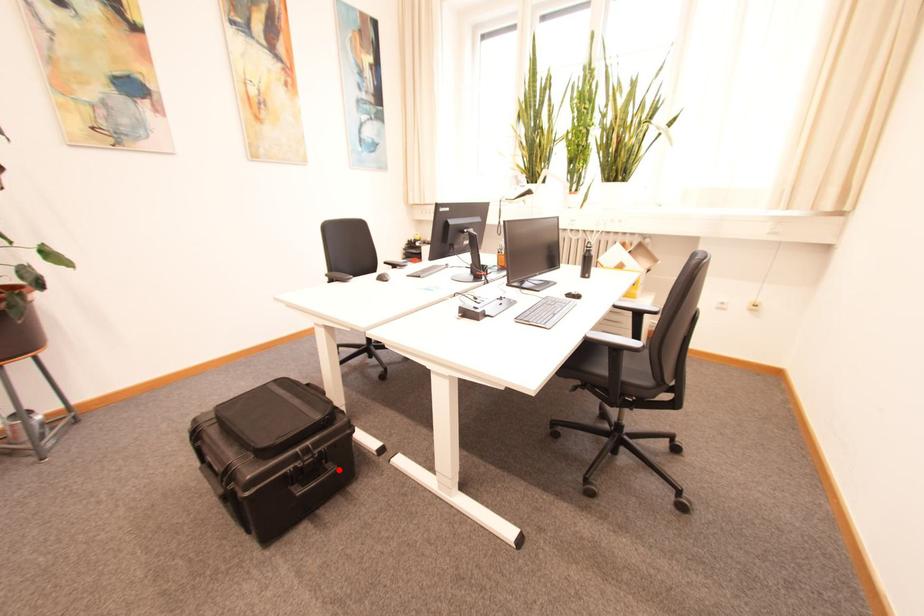
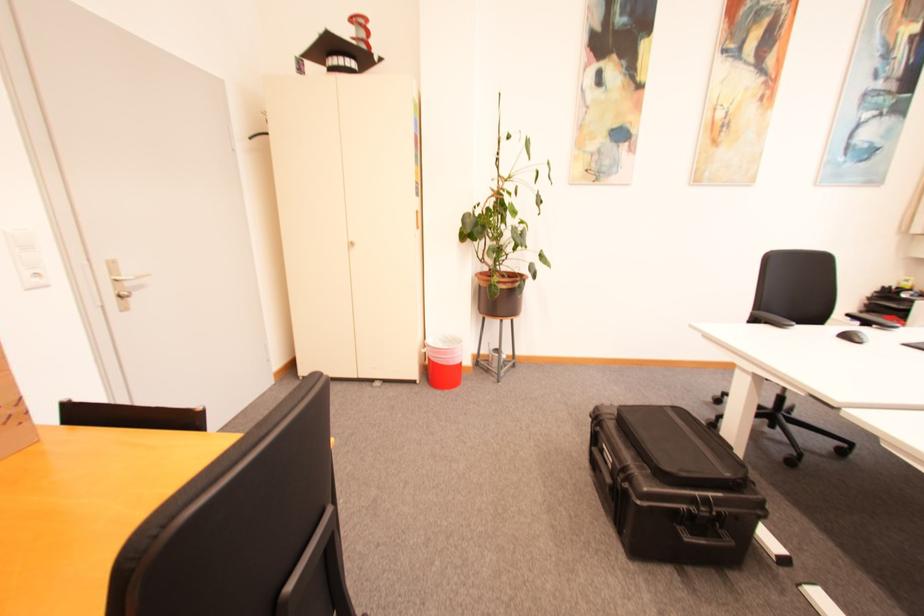
Locate, in the second image, the point that corresponds to the highlighted location in the first image.

(736, 541)